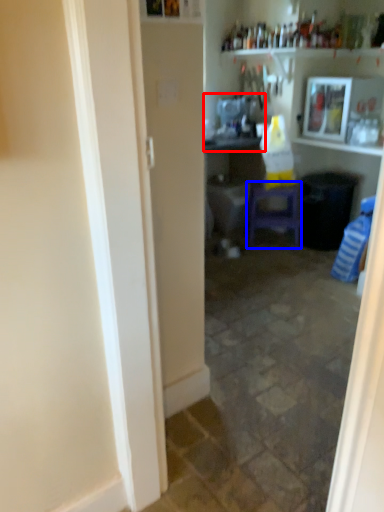
Question: Which point is further to the camera, sink (highlighted by a red box) or furniture (highlighted by a blue box)?

Choices:
 (A) sink
 (B) furniture

Answer: (B)